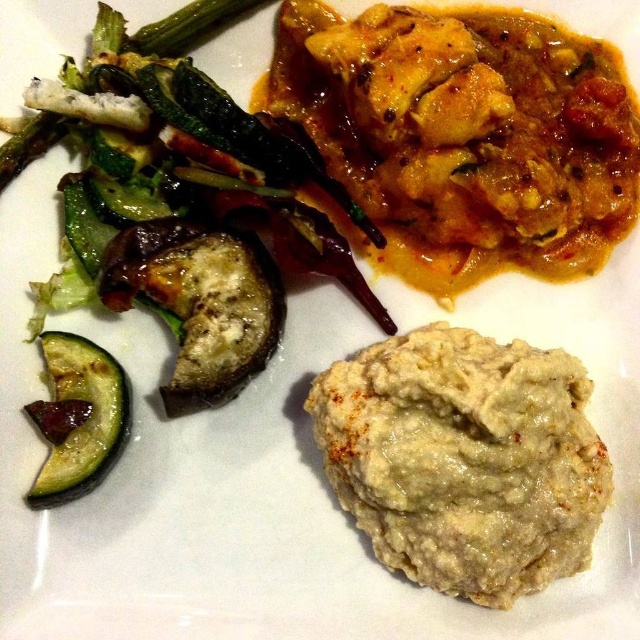
Can you confirm if white creamy paste at center is positioned to the left of green matte cucumber at lower left?

No, white creamy paste at center is not to the left of green matte cucumber at lower left.

Which is behind, point (416, 570) or point (65, 353)?

The point (65, 353) is behind.

This screenshot has height=640, width=640. I want to click on white creamy paste at center, so click(465, 460).